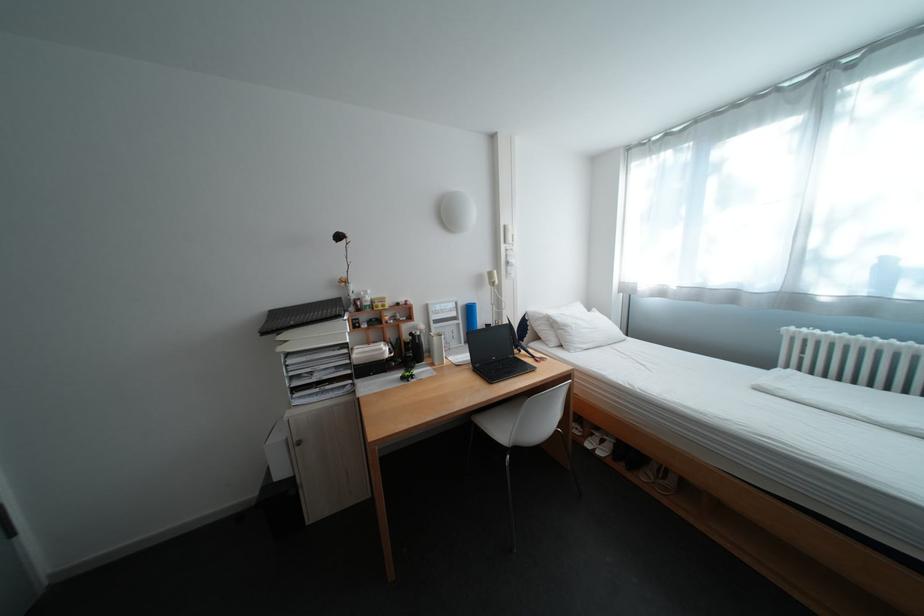
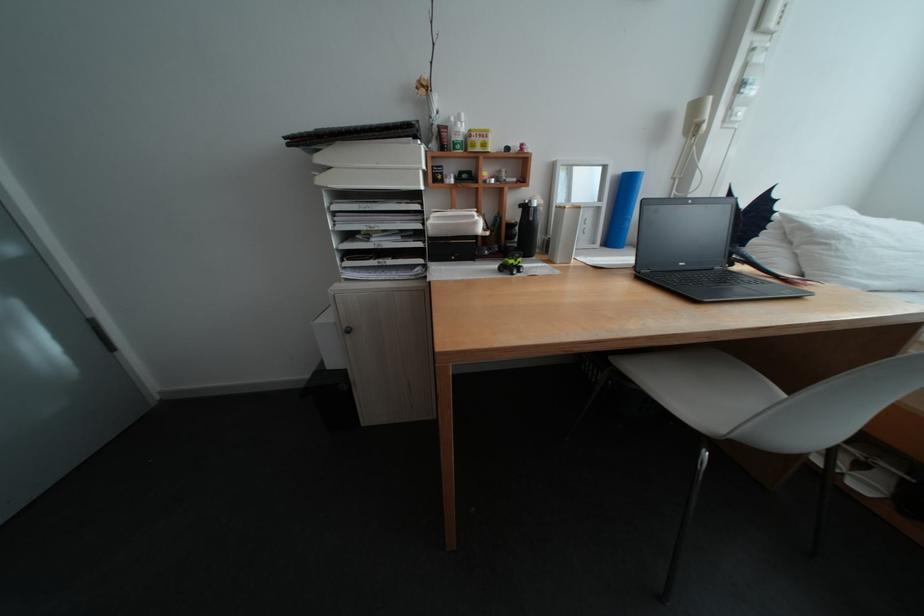
The point at (484, 422) is marked in the first image. Where is the corresponding point in the second image?

(625, 367)